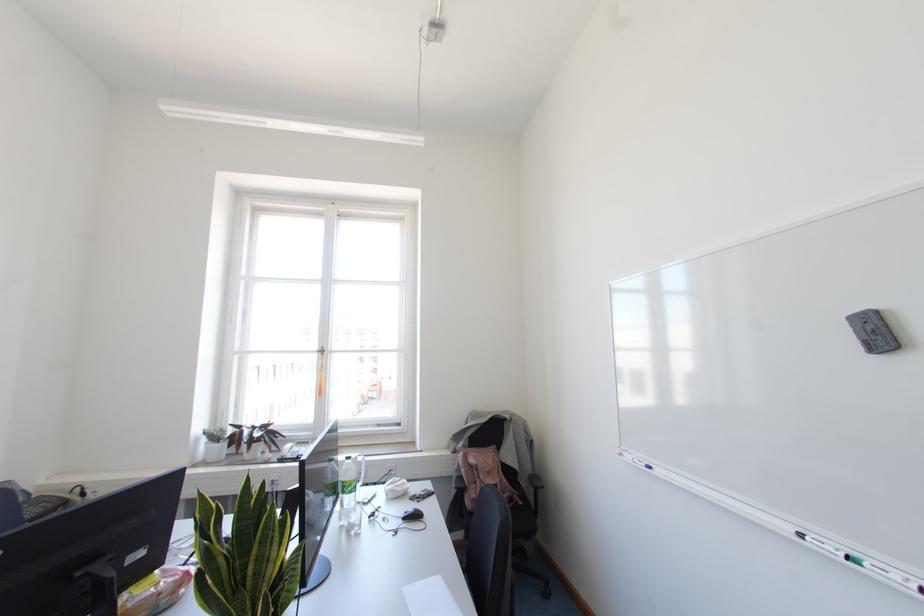
What do you see at coordinates (25, 506) in the screenshot? I see `the white telephone handset` at bounding box center [25, 506].